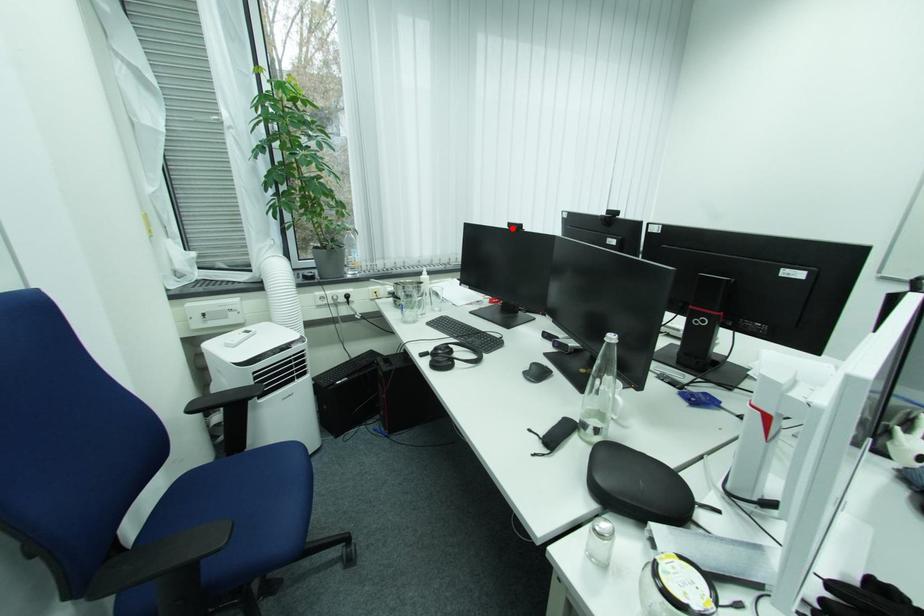
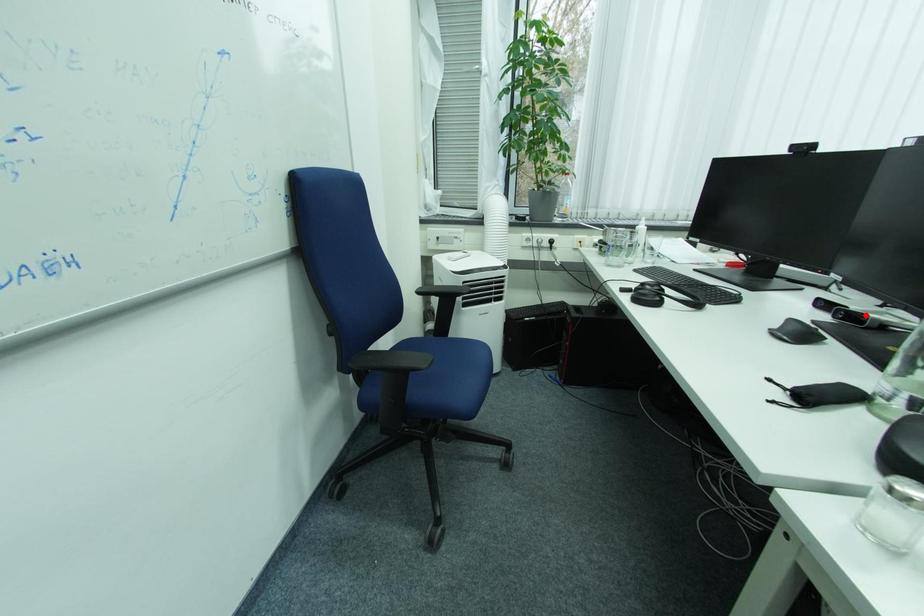
I am providing you with two images of the same scene from different viewpoints. A red point is marked on the first image and another point is marked on the second image. Do the highlighted points in image1 and image2 indicate the same real-world spot?

No